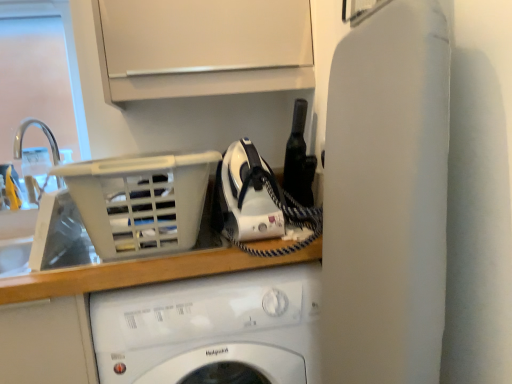
Question: Considering their positions, is white glossy washing machine at center located in front of or behind white plastic basket at upper left?

Choices:
 (A) front
 (B) behind

Answer: (B)

Question: From the image's perspective, is white glossy washing machine at center positioned above or below white plastic basket at upper left?

Choices:
 (A) above
 (B) below

Answer: (B)

Question: Based on their relative distances, which object is farther from the white plastic sink at left?

Choices:
 (A) white plastic basket at upper left
 (B) white glossy washing machine at center

Answer: (B)

Question: Which object is positioned closest to the white glossy washing machine at center?

Choices:
 (A) white plastic basket at upper left
 (B) white plastic sink at left

Answer: (A)